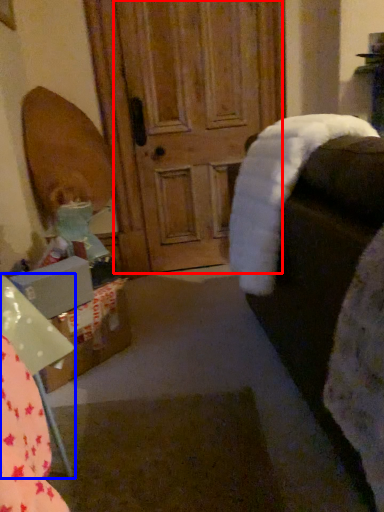
Question: Which object appears farthest to the camera in this image, screen door (highlighted by a red box) or furniture (highlighted by a blue box)?

Choices:
 (A) screen door
 (B) furniture

Answer: (A)